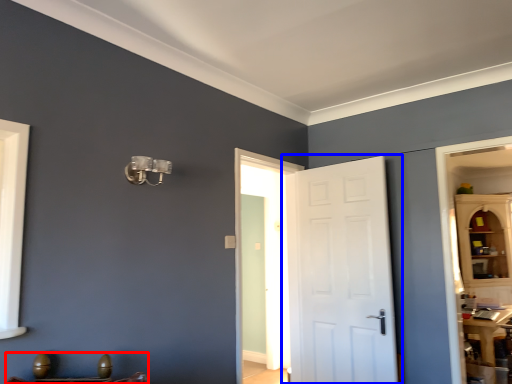
Question: Among these objects, which one is farthest to the camera, furniture (highlighted by a red box) or door (highlighted by a blue box)?

Choices:
 (A) furniture
 (B) door

Answer: (B)